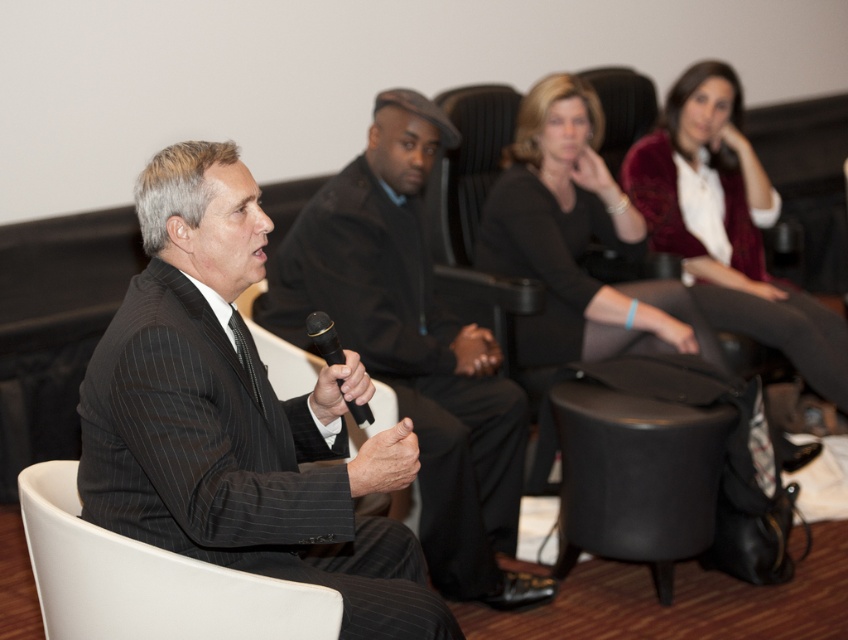
You are organizing a small event and need to ensure that the velvet maroon sweater at upper right and the white plastic chair at lower left can fit through a doorway that is 1.2 meters in height. Based on their heights, will both items pass through the doorway without any issues?

The velvet maroon sweater at upper right is taller than the white plastic chair at lower left. Since the doorway is 1.2 meters tall, we need to know the exact height of the taller item. However, the description only states the relative height between them. Without specific measurements, we cannot confirm if the tallest item exceeds the doorway height. Further information is required to determine if both items can pass through the doorway.

You are an event organizer who needs to ensure that the velvet maroon sweater at upper right and the white plastic chair at lower left fit through a doorway that is 1.2 meters wide. Based on their sizes, will both items fit through the doorway when moved individually?

The velvet maroon sweater at upper right is bigger than white plastic chair at lower left. Since the doorway is 1.2 meters wide, both items can fit through individually as the sweater, being the larger of the two, would still be smaller than the doorway width.